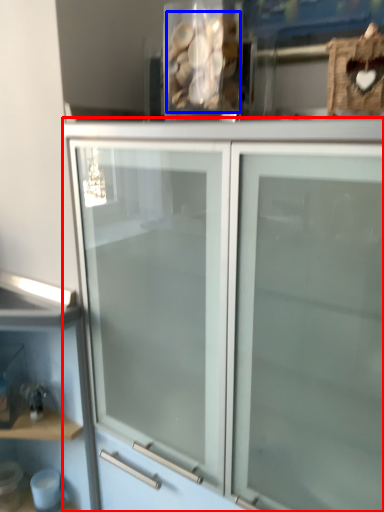
Question: Which point is closer to the camera, cupboard (highlighted by a red box) or stuff (highlighted by a blue box)?

Choices:
 (A) cupboard
 (B) stuff

Answer: (A)